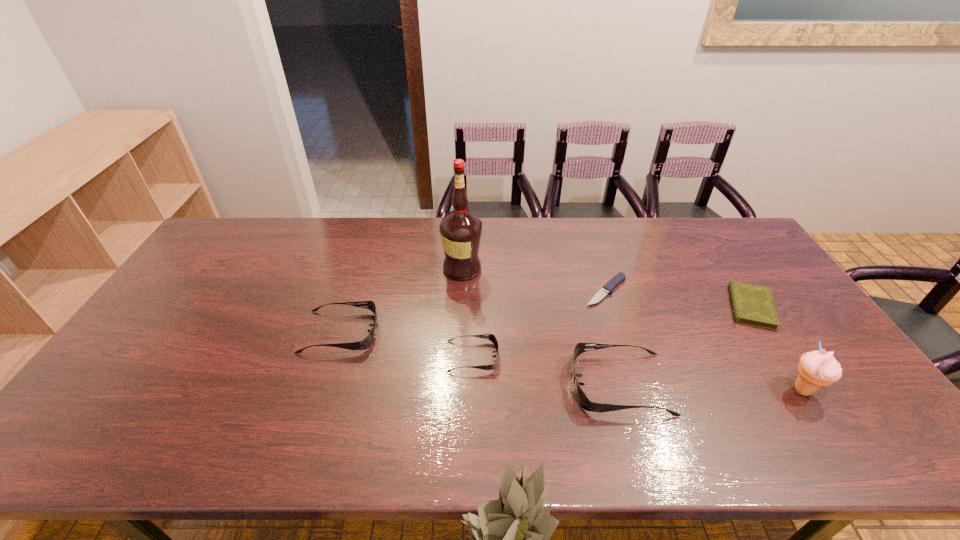
Locate an element on the screen. vacant space at the near right corner is located at coordinates (881, 415).

This screenshot has height=540, width=960. I want to click on unoccupied area between the diary and the rightmost sunglasses, so click(x=685, y=346).

This screenshot has height=540, width=960. What are the coordinates of `free space between the second sunglasses from right to left and the leftmost sunglasses` in the screenshot? It's located at (406, 344).

I want to click on vacant area between the icecream and the rightmost sunglasses, so click(711, 387).

I want to click on blank region between the alcohol and the rightmost sunglasses, so click(x=540, y=327).

The width and height of the screenshot is (960, 540). I want to click on free spot between the rightmost sunglasses and the alcohol, so click(540, 327).

Find the location of a particular element. This screenshot has height=540, width=960. vacant point located between the icecream and the leftmost sunglasses is located at coordinates (571, 361).

Where is `vacant space that is in between the rightmost sunglasses and the tallest object`? The width and height of the screenshot is (960, 540). vacant space that is in between the rightmost sunglasses and the tallest object is located at coordinates (540, 327).

I want to click on empty location between the alcohol and the second sunglasses from right to left, so click(x=468, y=313).

At what (x,y) coordinates should I click in order to perform the action: click on vacant region between the icecream and the tallest object. Please return your answer as a coordinate pair (x, y). Looking at the image, I should click on (633, 329).